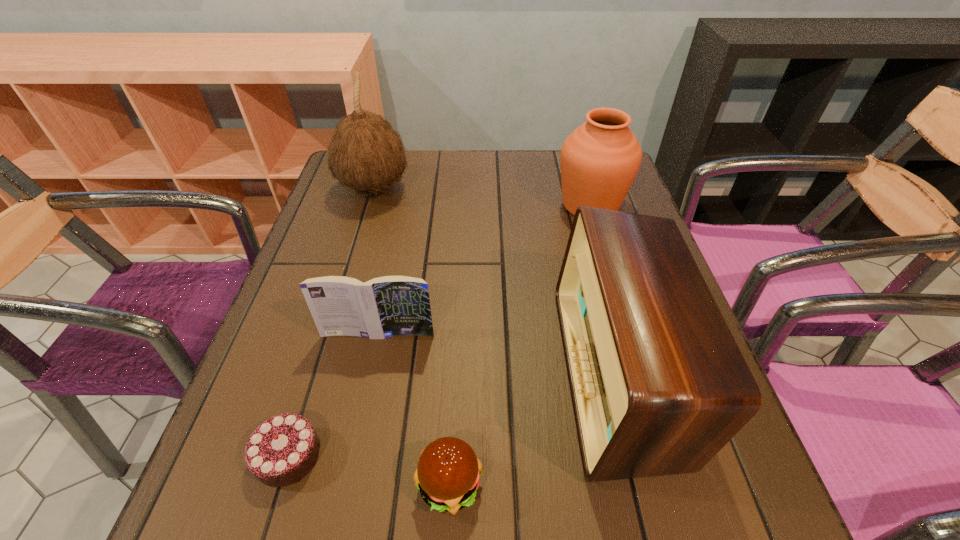
The height and width of the screenshot is (540, 960). In order to click on free space at the left edge of the desktop in this screenshot , I will do 323,272.

You are a GUI agent. You are given a task and a screenshot of the screen. Output one action in this format:
    pyautogui.click(x=<x>, y=<y>)
    Task: Click on the vacant area at the near left corner
    
    Given the screenshot: What is the action you would take?
    pyautogui.click(x=288, y=488)

Locate an element on the screen. The width and height of the screenshot is (960, 540). vacant space in between the second shortest object and the urn is located at coordinates (520, 345).

At what (x,y) coordinates should I click in order to perform the action: click on empty space between the third shortest object and the radio receiver. Please return your answer as a coordinate pair (x, y). Looking at the image, I should click on (497, 354).

The width and height of the screenshot is (960, 540). Identify the location of free point between the coconut and the radio receiver. (495, 281).

You are a GUI agent. You are given a task and a screenshot of the screen. Output one action in this format:
    pyautogui.click(x=<x>, y=<y>)
    Task: Click on the empty space between the book and the tallest object
    This screenshot has height=540, width=960.
    Given the screenshot: What is the action you would take?
    pyautogui.click(x=376, y=262)

Where is `free space that is in between the book and the fifth tallest object`? Image resolution: width=960 pixels, height=540 pixels. free space that is in between the book and the fifth tallest object is located at coordinates (414, 409).

Find the location of a particular element. The image size is (960, 540). free space between the radio receiver and the book is located at coordinates (497, 354).

This screenshot has height=540, width=960. I want to click on free area in between the chocolate cake and the fourth tallest object, so click(x=333, y=395).

Locate an element on the screen. The width and height of the screenshot is (960, 540). free point between the shortest object and the book is located at coordinates (333, 395).